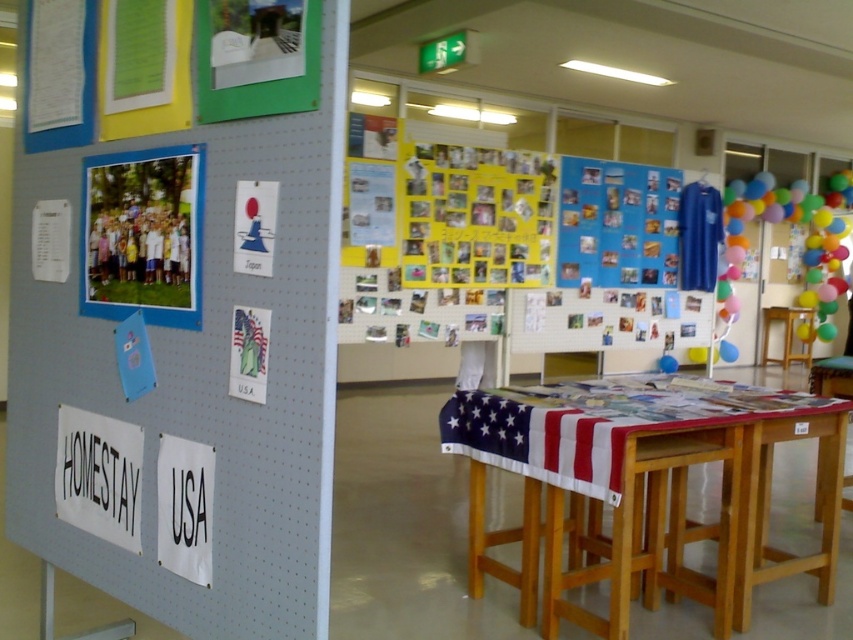
You are a student organizing the display board and need to hang a new item between the matte paper photo at left and the matte paper poster at upper left. The new item is 6 inches wide. Is there enough space between them to fit the new item without overlapping?

The distance between the matte paper photo at left and the matte paper poster at upper left is 12.73 inches. Since the new item is 6 inches wide, there is enough space to fit it between them without overlapping.